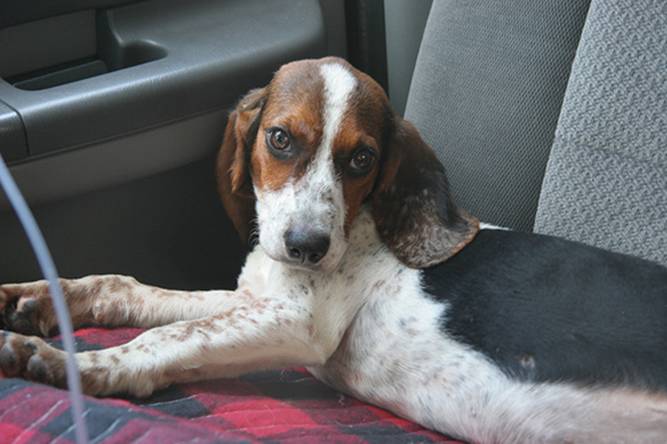
I want to click on side of door, so click(x=113, y=222).